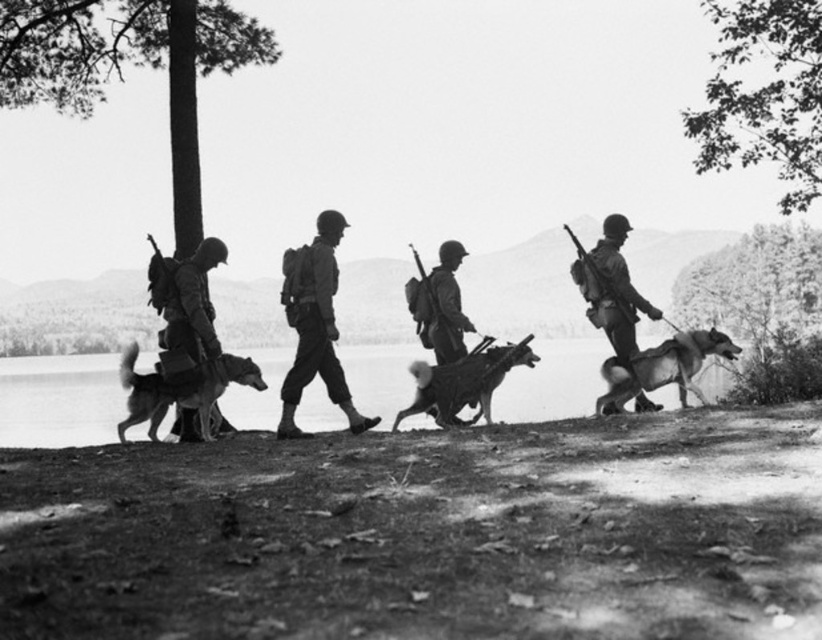
You are a photographer analyzing this black and white image. You notice the metallic helmet at center and the smooth fur dog at right. Based on their positions, which object is closer to the left edge of the photograph?

The metallic helmet at center is positioned on the left side of the smooth fur dog at right, so the metallic helmet at center is closer to the left edge of the photograph.

You are a photographer analyzing this historical image. You notice the brushed metal helmet at left and the smooth metal rifle at center. Which object has a greater width?

The brushed metal helmet at left has a greater width than the smooth metal rifle at center.